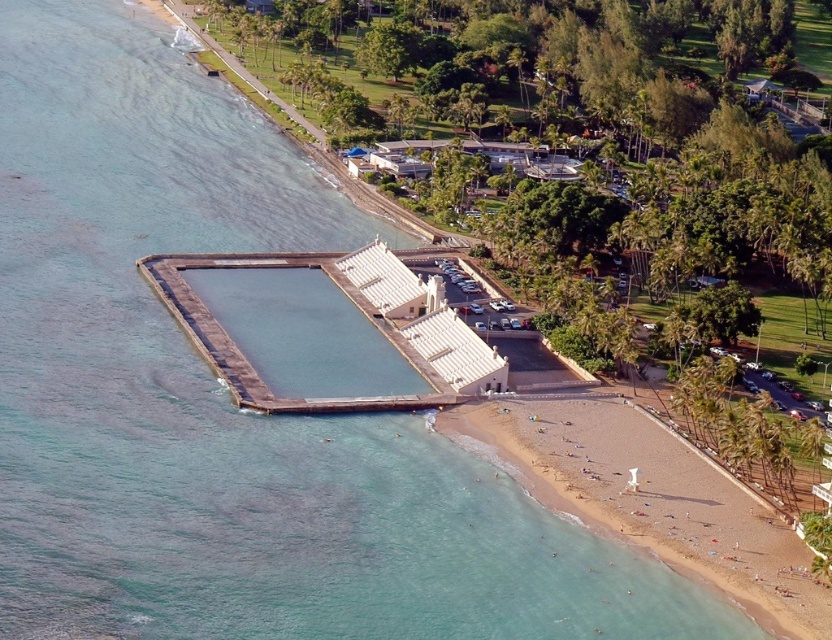
Is beige sand beach at lower right thinner than smooth concrete dock at lower center?

Correct, beige sand beach at lower right's width is less than smooth concrete dock at lower center's.

Which of these two, beige sand beach at lower right or smooth concrete dock at lower center, stands shorter?

beige sand beach at lower right is shorter.

Where is `beige sand beach at lower right`? The width and height of the screenshot is (832, 640). beige sand beach at lower right is located at coordinates (652, 497).